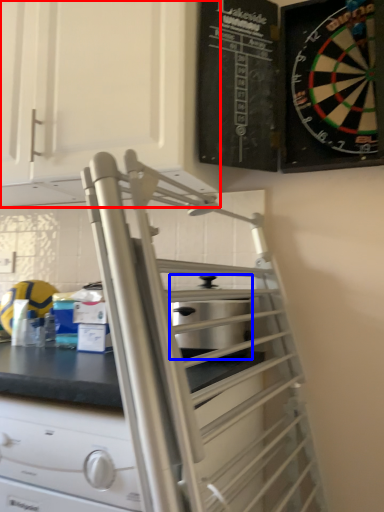
Question: Among these objects, which one is farthest to the camera, cabinetry (highlighted by a red box) or appliance (highlighted by a blue box)?

Choices:
 (A) cabinetry
 (B) appliance

Answer: (A)